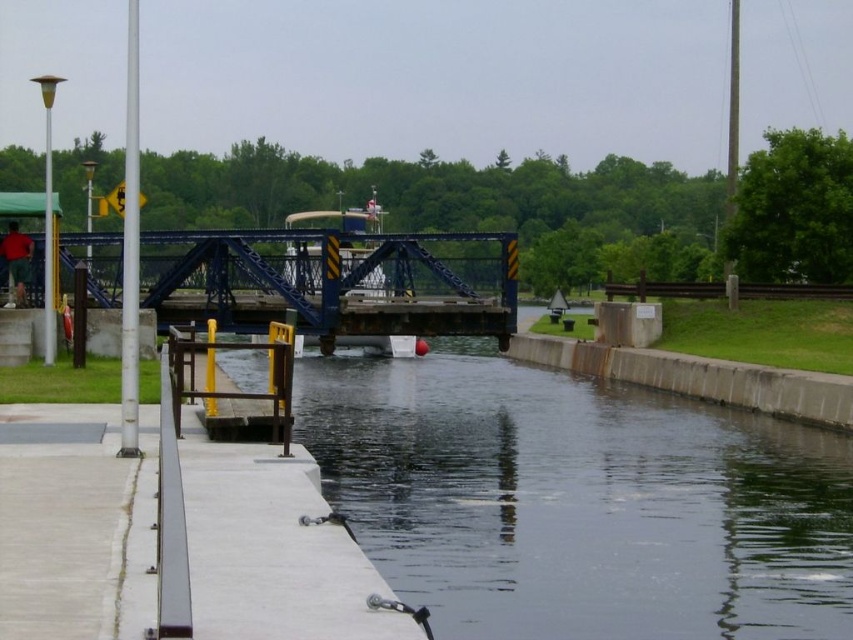
You are standing on the concrete walkway near the lock gates and want to reach the smooth concrete river at center. What direction should you move in to get there?

The smooth concrete river at center is located at point 0.783 on the x axis and 0.679 on the y axis, so you should move towards the center of the image to reach it.

Consider the image. You are a maintenance worker needing to cross from one side of the smooth concrete river at center to the other. The blue metallic bridge at center is available. Considering their sizes, which structure would you use to cross safely?

The blue metallic bridge at center is larger than the smooth concrete river at center, so you should use the blue metallic bridge at center to cross safely.